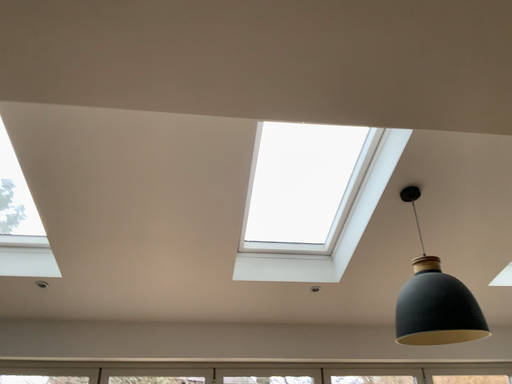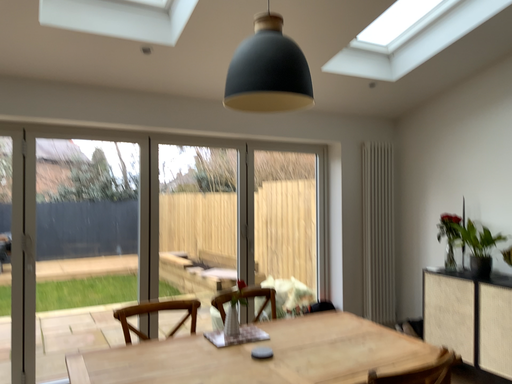
Question: Which way did the camera rotate in the video?

Choices:
 (A) rotated right
 (B) rotated left

Answer: (A)